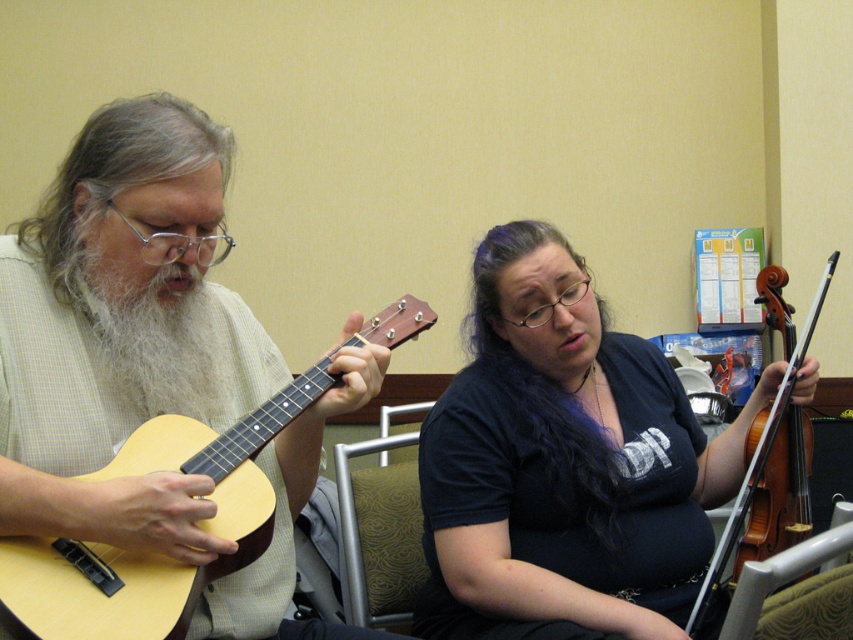
Which of these two, purple silky hair at center or green fabric chair at center, stands shorter?

With less height is green fabric chair at center.

Identify the location of purple silky hair at center. Image resolution: width=853 pixels, height=640 pixels. (546, 380).

Does point (682, 493) lie in front of point (821, 300)?

Yes, it is in front of point (821, 300).

Who is positioned more to the right, matte black shirt at center or wooden violin at right?

wooden violin at right

Identify the location of matte black shirt at center. The image size is (853, 640). (564, 465).

Can you confirm if light wood acoustic guitar at left is bigger than grayhair at left?

Correct, light wood acoustic guitar at left is larger in size than grayhair at left.

Between point (376, 312) and point (192, 116), which one is positioned in front?

Point (192, 116) is more forward.

Identify the location of light wood acoustic guitar at left. This screenshot has height=640, width=853. (154, 554).